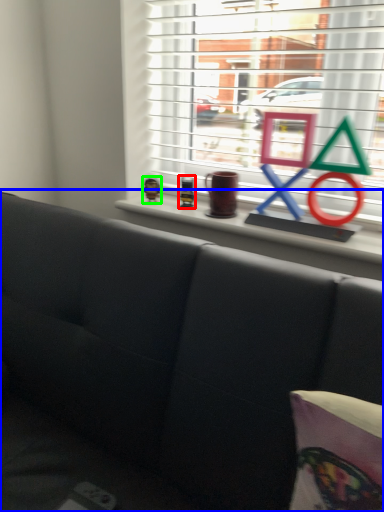
Question: Considering the real-world distances, which object is closest to toy (highlighted by a red box)? studio couch (highlighted by a blue box) or toy (highlighted by a green box).

Choices:
 (A) studio couch
 (B) toy

Answer: (B)